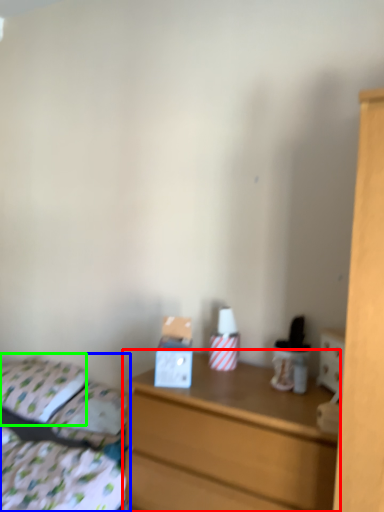
Question: Which is farther away from chest of drawers (highlighted by a red box)? bed (highlighted by a blue box) or pillow (highlighted by a green box)?

Choices:
 (A) bed
 (B) pillow

Answer: (B)